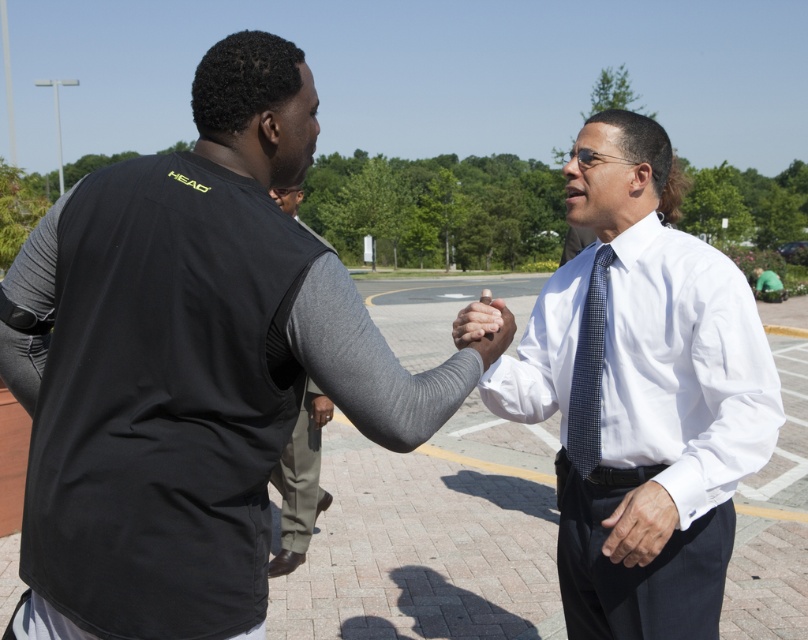
Question: Is black mesh vest at center smaller than blue checkered tie at center?

Choices:
 (A) yes
 (B) no

Answer: (B)

Question: Does gray fabric sleeve at center appear under blue checkered tie at center?

Choices:
 (A) no
 (B) yes

Answer: (B)

Question: Based on their relative distances, which object is farther from the blue checkered tie at center?

Choices:
 (A) black mesh vest at center
 (B) gray fabric sleeve at center
 (C) white shirt at center

Answer: (B)

Question: Does white shirt at center have a larger size compared to gray fabric sleeve at center?

Choices:
 (A) no
 (B) yes

Answer: (B)

Question: Which point is farther from the camera taking this photo?

Choices:
 (A) (x=583, y=438)
 (B) (x=297, y=200)

Answer: (B)

Question: Estimate the real-world distances between objects in this image. Which object is closer to the blue checkered tie at center?

Choices:
 (A) black mesh vest at center
 (B) white shirt at center

Answer: (B)